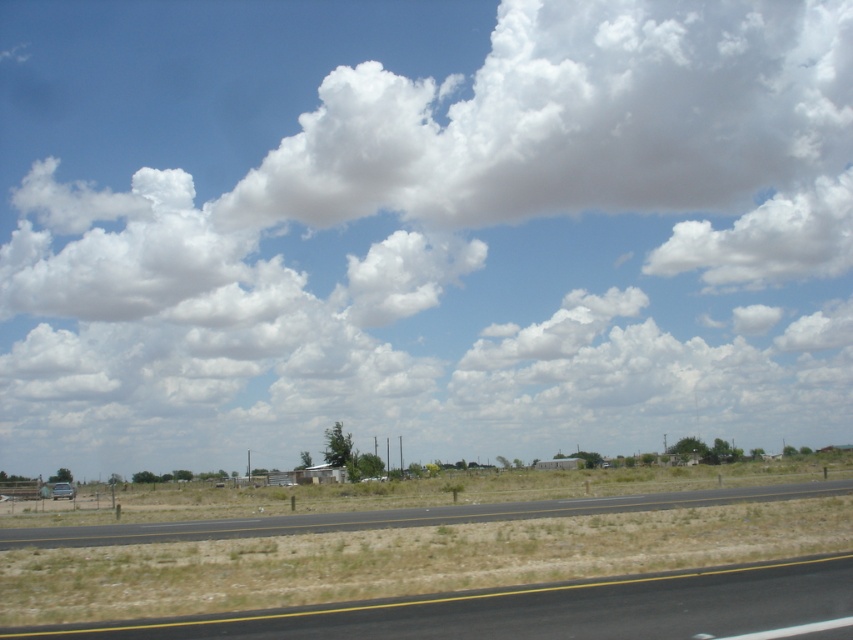
You are standing on the road and looking towards the sky. Is the point at coordinates (421, 227) located on the white fluffy cloud at upper center?

Yes, the point at coordinates (421, 227) is located on the white fluffy cloud at upper center according to the description.